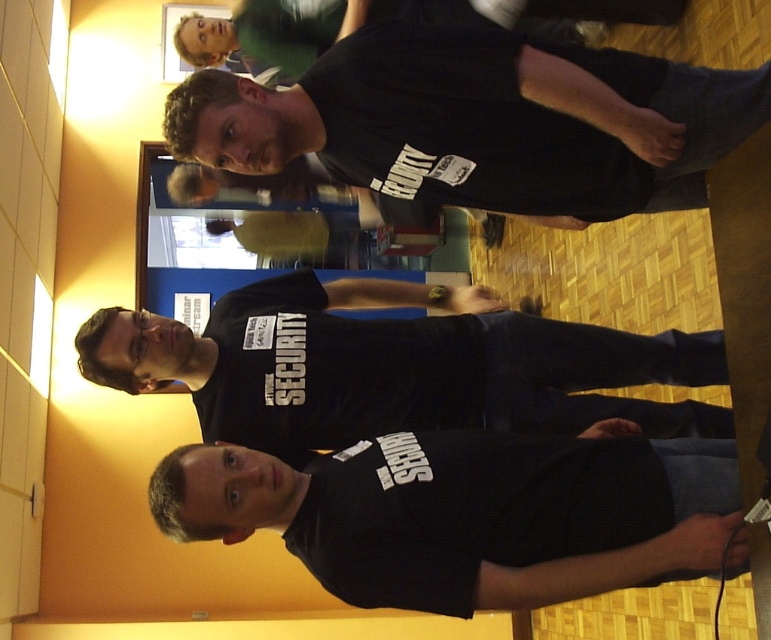
Is black cotton t-shirt at upper center further to camera compared to black matte security shirt at center?

No, black cotton t-shirt at upper center is in front of black matte security shirt at center.

Between point (470, 29) and point (103, 381), which one is positioned in front?

Point (470, 29) is in front.

Image resolution: width=771 pixels, height=640 pixels. Find the location of `black cotton t-shirt at upper center`. black cotton t-shirt at upper center is located at coordinates (480, 122).

Can you confirm if black cotton t-shirt at upper center is wider than matte black security guard at upper center?

Yes.

Who is more forward, (684, 134) or (184, 60)?

Positioned in front is point (684, 134).

Where is `black cotton t-shirt at upper center`? The width and height of the screenshot is (771, 640). black cotton t-shirt at upper center is located at coordinates (480, 122).

Does point (312, 497) come farther from viewer compared to point (274, 6)?

No, it is in front of (274, 6).

Where is `black matte shirt at lower center`? Image resolution: width=771 pixels, height=640 pixels. black matte shirt at lower center is located at coordinates pyautogui.click(x=466, y=513).